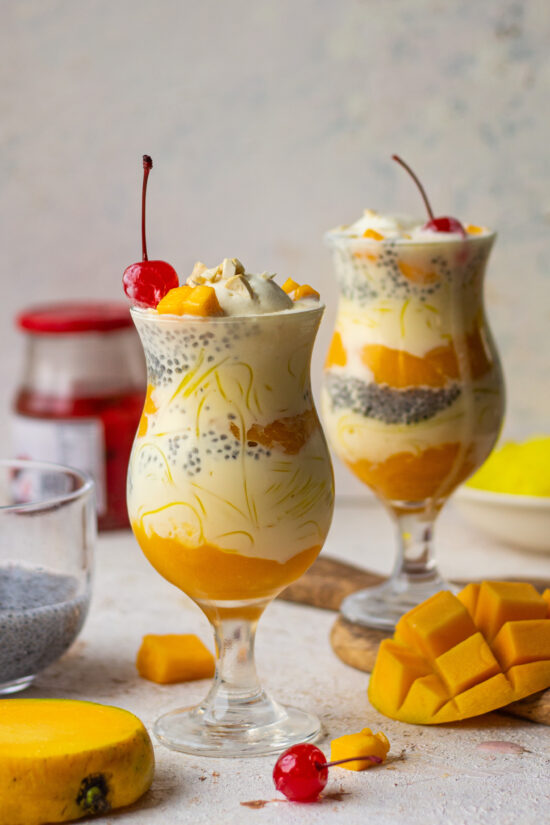
Locate an element on the screen. tabletop is located at coordinates (233, 804), (456, 800), (317, 654), (116, 594), (472, 515).